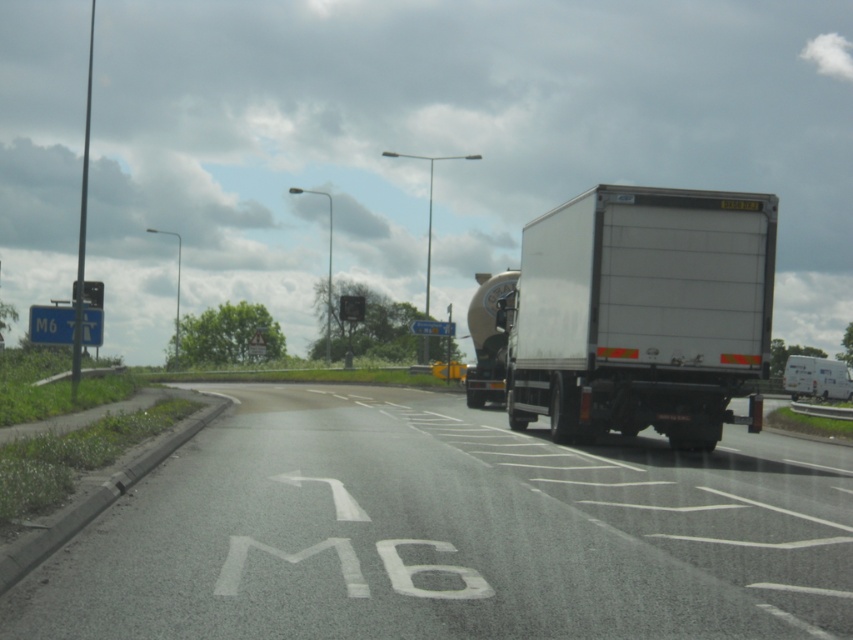
You are a driver approaching the white asphalt road at lower left and the white matte trailer truck at center. Which object is positioned lower in the image?

The white asphalt road at lower left is positioned below the white matte trailer truck at center, so it is lower in the image.

You are a GPS navigator and need to inform the driver about the position of the white matte trailer truck at center relative to the M6 motorway markings. Based on the coordinates provided, can you determine if the truck is positioned correctly according to the lane markings?

The white matte trailer truck at center is located at point coordinates, so it is positioned correctly within the lane markings on the M6 motorway as per the given coordinates.